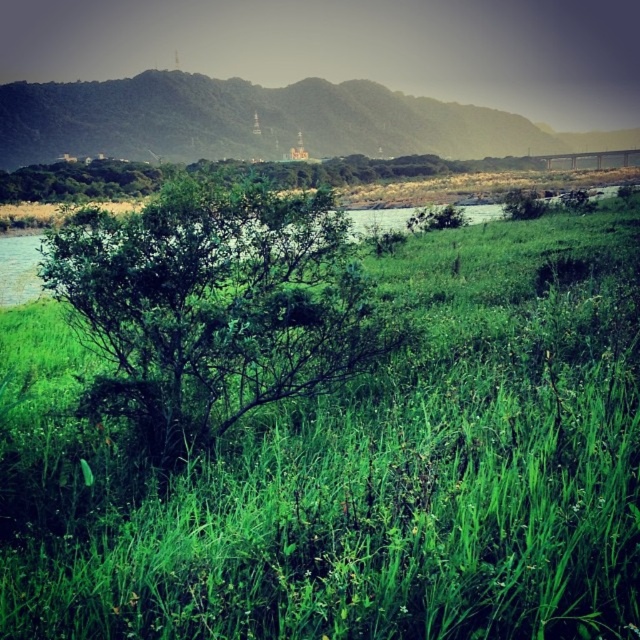
You are an environmental scientist assessing the vegetation in this landscape. You need to determine which area has a denser plant structure between the green leafy grass at center and the green grassy hill at upper center. Based on the scene, which one is denser?

The green grassy hill at upper center has a denser plant structure because it is thicker than the green leafy grass at center.

You are standing in the natural landscape scene and want to walk towards the green leafy grass at center and the green leafy bush at center. Which one will you reach first?

You will reach the green leafy grass at center first because it is closer to you than the green leafy bush at center.